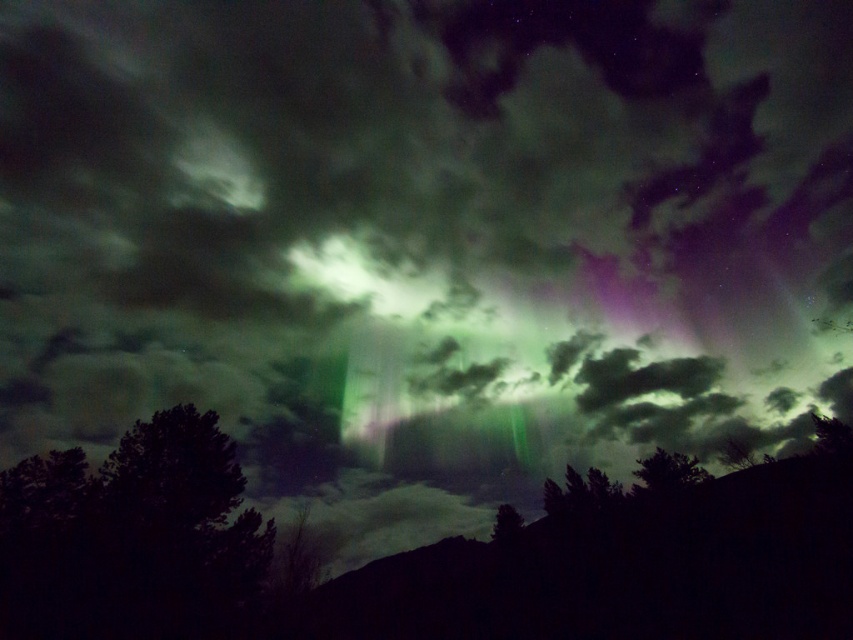
Can you confirm if dark green leafy tree at lower left is shorter than green leafy tree at lower center?

No, dark green leafy tree at lower left is not shorter than green leafy tree at lower center.

Can you confirm if dark green leafy tree at lower left is wider than green leafy tree at lower center?

Yes.

Find the location of a particular element. dark green leafy tree at lower left is located at coordinates (131, 538).

The image size is (853, 640). I want to click on dark green leafy tree at lower left, so click(x=131, y=538).